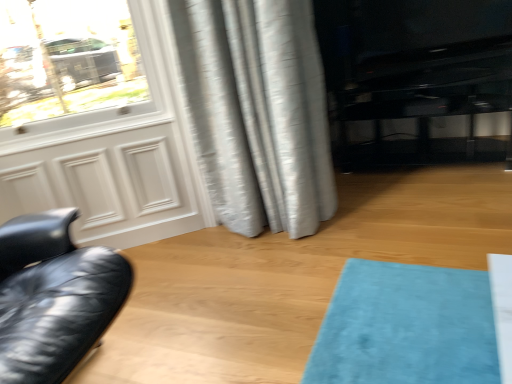
Question: Is matte white screen door at left positioned before black glossy entertainment center at right?

Choices:
 (A) yes
 (B) no

Answer: (A)

Question: Is matte white screen door at left behind black glossy entertainment center at right?

Choices:
 (A) no
 (B) yes

Answer: (A)

Question: Does matte white screen door at left touch black glossy entertainment center at right?

Choices:
 (A) yes
 (B) no

Answer: (B)

Question: Is matte white screen door at left positioned with its back to black glossy entertainment center at right?

Choices:
 (A) no
 (B) yes

Answer: (A)

Question: From the image's perspective, is matte white screen door at left located above black glossy entertainment center at right?

Choices:
 (A) no
 (B) yes

Answer: (A)

Question: In terms of size, does black glossy entertainment center at right appear bigger or smaller than silvery textured curtain at center?

Choices:
 (A) small
 (B) big

Answer: (A)

Question: Is black glossy entertainment center at right taller or shorter than silvery textured curtain at center?

Choices:
 (A) tall
 (B) short

Answer: (B)

Question: Is black glossy entertainment center at right situated inside silvery textured curtain at center or outside?

Choices:
 (A) outside
 (B) inside

Answer: (A)

Question: From the image's perspective, is black glossy entertainment center at right positioned above or below silvery textured curtain at center?

Choices:
 (A) below
 (B) above

Answer: (B)

Question: Considering the positions of point (13, 175) and point (480, 41), is point (13, 175) closer or farther from the camera than point (480, 41)?

Choices:
 (A) farther
 (B) closer

Answer: (B)

Question: From their relative heights in the image, would you say matte white screen door at left is taller or shorter than black glossy entertainment center at right?

Choices:
 (A) tall
 (B) short

Answer: (A)

Question: Relative to black glossy entertainment center at right, is matte white screen door at left in front or behind?

Choices:
 (A) behind
 (B) front

Answer: (B)

Question: Is matte white screen door at left to the left or to the right of black glossy entertainment center at right in the image?

Choices:
 (A) left
 (B) right

Answer: (A)

Question: Considering the positions of matte white screen door at left and silvery textured curtain at center in the image, is matte white screen door at left taller or shorter than silvery textured curtain at center?

Choices:
 (A) tall
 (B) short

Answer: (B)

Question: From the image's perspective, is matte white screen door at left positioned above or below silvery textured curtain at center?

Choices:
 (A) below
 (B) above

Answer: (A)